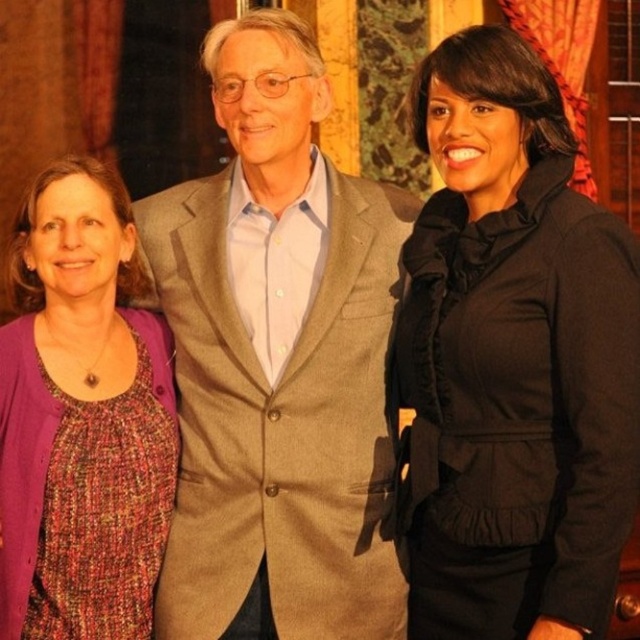
Does black satin jacket at right lie behind multicolored woven blouse at left?

No.

Which is below, black satin jacket at right or multicolored woven blouse at left?

multicolored woven blouse at left

I want to click on black satin jacket at right, so pyautogui.click(x=513, y=358).

Identify the location of black satin jacket at right. (513, 358).

Looking at this image, does light brown wool suit at center have a greater height compared to black satin jacket at right?

Yes.

Between light brown wool suit at center and black satin jacket at right, which one is positioned lower?

black satin jacket at right

Is point (321, 80) closer to viewer compared to point (541, 579)?

No.

Identify the location of light brown wool suit at center. (276, 362).

Consider the image. Can you confirm if light brown wool suit at center is shorter than multicolored woven blouse at left?

No.

Is light brown wool suit at center positioned in front of multicolored woven blouse at left?

No, it is not.

Identify the location of light brown wool suit at center. The width and height of the screenshot is (640, 640). (276, 362).